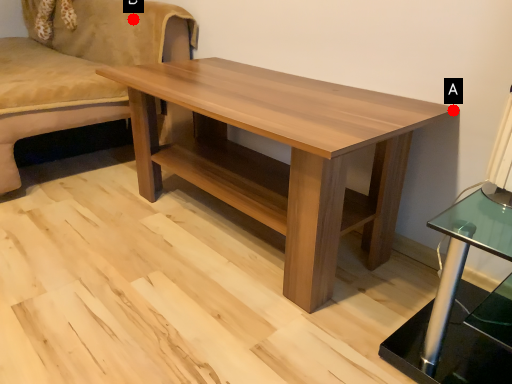
Question: Two points are circled on the image, labeled by A and B beside each circle. Among these points, which one is farthest from the camera?

Choices:
 (A) A is further
 (B) B is further

Answer: (B)